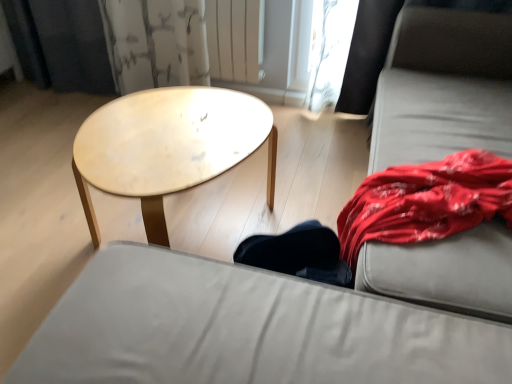
Question: From a real-world perspective, does gray fabric couch at right sit lower than white painted metal radiator at upper center?

Choices:
 (A) yes
 (B) no

Answer: (A)

Question: Is gray fabric couch at right thinner than white painted metal radiator at upper center?

Choices:
 (A) no
 (B) yes

Answer: (A)

Question: From the image's perspective, is gray fabric couch at right over white painted metal radiator at upper center?

Choices:
 (A) no
 (B) yes

Answer: (A)

Question: Does gray fabric couch at right appear on the left side of white painted metal radiator at upper center?

Choices:
 (A) yes
 (B) no

Answer: (B)

Question: From the image's perspective, does gray fabric couch at right appear lower than white painted metal radiator at upper center?

Choices:
 (A) no
 (B) yes

Answer: (B)

Question: From the image's perspective, is white painted metal radiator at upper center located above or below gray fabric couch at right?

Choices:
 (A) above
 (B) below

Answer: (A)

Question: In terms of height, does white painted metal radiator at upper center look taller or shorter compared to gray fabric couch at right?

Choices:
 (A) short
 (B) tall

Answer: (A)

Question: Considering their positions, is white painted metal radiator at upper center located in front of or behind gray fabric couch at right?

Choices:
 (A) front
 (B) behind

Answer: (B)

Question: Is white painted metal radiator at upper center wider or thinner than gray fabric couch at right?

Choices:
 (A) wide
 (B) thin

Answer: (B)

Question: From the image's perspective, is gray fabric couch at right positioned above or below matte gray studio couch at center?

Choices:
 (A) below
 (B) above

Answer: (B)

Question: In terms of width, does gray fabric couch at right look wider or thinner when compared to matte gray studio couch at center?

Choices:
 (A) thin
 (B) wide

Answer: (B)

Question: Considering the positions of gray fabric couch at right and matte gray studio couch at center in the image, is gray fabric couch at right bigger or smaller than matte gray studio couch at center?

Choices:
 (A) big
 (B) small

Answer: (A)

Question: Is gray fabric couch at right spatially inside matte gray studio couch at center, or outside of it?

Choices:
 (A) outside
 (B) inside

Answer: (A)

Question: Considering their positions, is light wood/texture coffee table at center located in front of or behind white painted metal radiator at upper center?

Choices:
 (A) front
 (B) behind

Answer: (A)

Question: Looking at the image, does light wood/texture coffee table at center seem bigger or smaller compared to white painted metal radiator at upper center?

Choices:
 (A) small
 (B) big

Answer: (B)